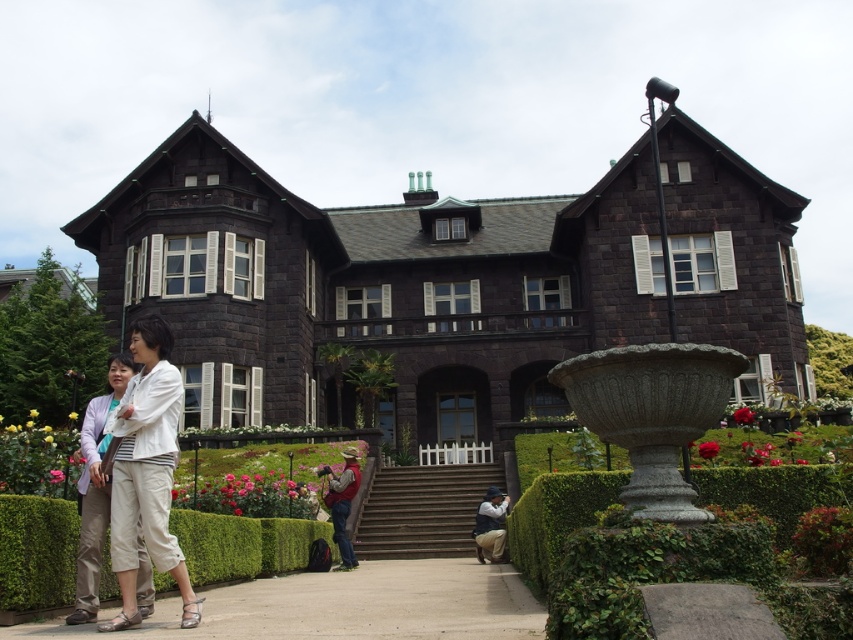
You are planning to place a rustic brown vest at center on the smooth concrete stairs at center. Based on their widths, will the vest fit without overhanging the edges?

The smooth concrete stairs at center might be wider than rustic brown vest at center, so there is a possibility that the vest will fit without overhanging the edges, but the exact width comparison is uncertain.

You are a photographer setting up equipment in front of the building. You have two items to place on the ground for a shot. The light beige pants at lower left and the denim jacket at lower center. Since you want to ensure they are visually balanced, which item should you place closer to the camera to make them appear the same size?

→ The light beige pants at lower left should be placed closer to the camera because its width is greater than the denim jacket at lower center. By positioning the wider item nearer, it will appear smaller in the frame, balancing the visual size with the jacket farther away.